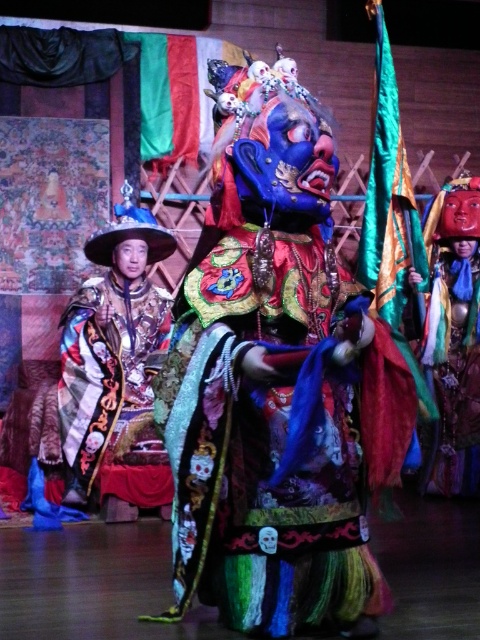
Question: Estimate the real-world distances between objects in this image. Which object is closer to the velvet-like multicolored robe at center?

Choices:
 (A) velvet brocade robe at center
 (B) velvet-like blue mask at center

Answer: (A)

Question: Among these points, which one is nearest to the camera?

Choices:
 (A) tap(240, 582)
 (B) tap(444, 362)

Answer: (A)

Question: Estimate the real-world distances between objects in this image. Which object is closer to the velvet-like blue mask at center?

Choices:
 (A) velvet brocade robe at center
 (B) velvet-like multicolored robe at center

Answer: (A)

Question: Observing the image, what is the correct spatial positioning of velvet-like blue mask at center in reference to velvet brocade robe at center?

Choices:
 (A) above
 (B) below

Answer: (A)

Question: Does velvet-like blue mask at center have a greater width compared to velvet-like multicolored robe at center?

Choices:
 (A) yes
 (B) no

Answer: (A)

Question: Can you confirm if velvet brocade robe at center is wider than velvet-like multicolored robe at center?

Choices:
 (A) no
 (B) yes

Answer: (B)